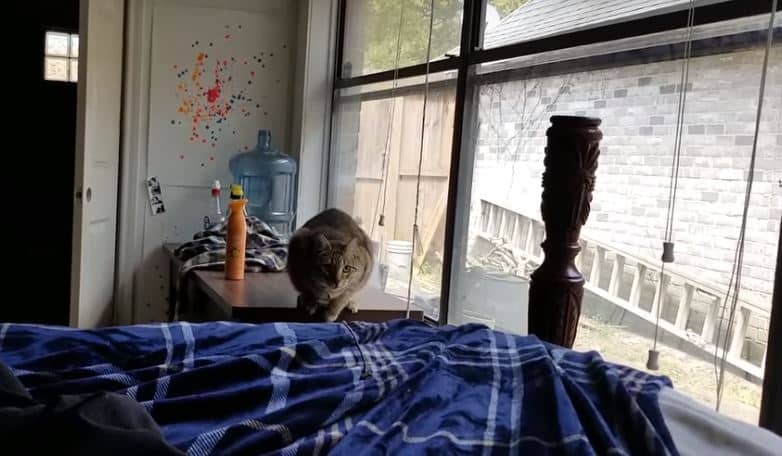
Where is `windows`? The width and height of the screenshot is (782, 456). windows is located at coordinates (635, 254), (402, 191), (406, 36), (536, 10), (67, 58).